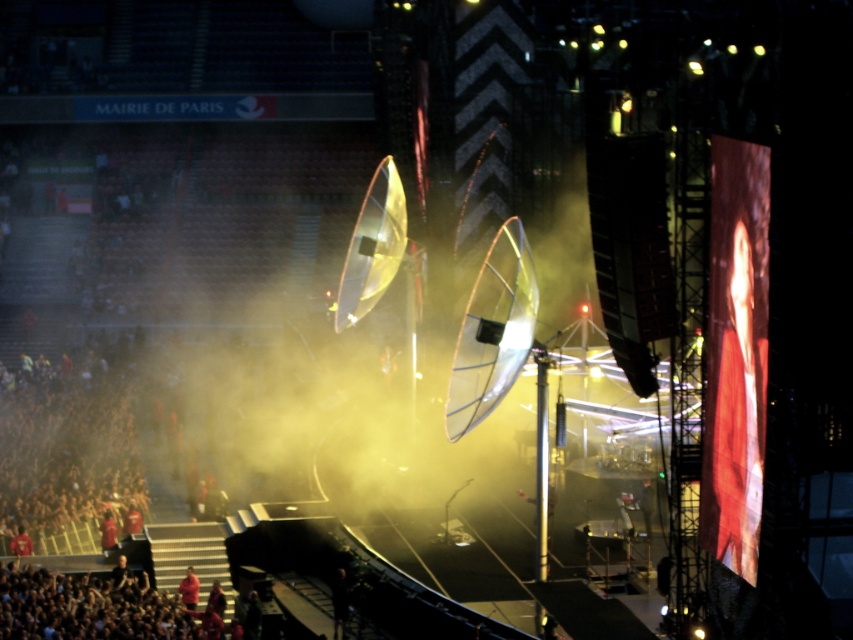
Question: Which of these objects is positioned farthest from the red fabric person at lower left?

Choices:
 (A) red fabric crowd at lower left
 (B) matte red shirt at center

Answer: (A)

Question: Does matte red shirt at center appear over red fabric person at lower left?

Choices:
 (A) yes
 (B) no

Answer: (B)

Question: Which object is positioned closest to the red fabric crowd at lower left?

Choices:
 (A) red fabric person at lower left
 (B) matte red shirt at center

Answer: (B)

Question: Is matte red shirt at center thinner than red fabric person at lower left?

Choices:
 (A) yes
 (B) no

Answer: (A)

Question: Which point is farther from the camera taking this photo?

Choices:
 (A) (192, 600)
 (B) (107, 532)

Answer: (B)

Question: Is matte red shirt at center wider than red fabric person at lower left?

Choices:
 (A) no
 (B) yes

Answer: (A)